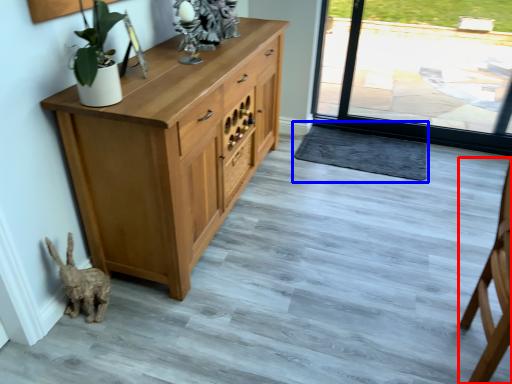
Question: Among these objects, which one is farthest to the camera, chair (highlighted by a red box) or doormat (highlighted by a blue box)?

Choices:
 (A) chair
 (B) doormat

Answer: (B)